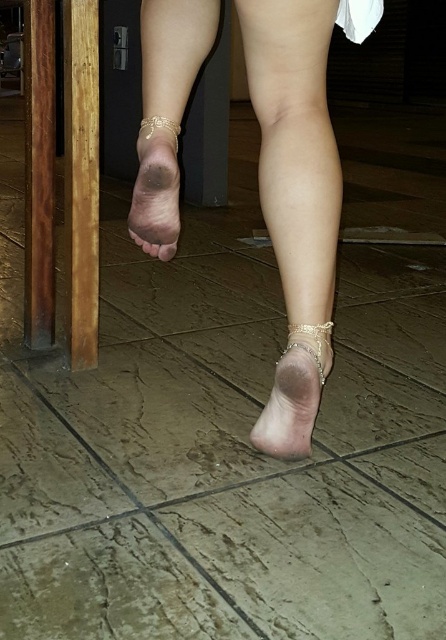
You are a stylist preparing to photograph a model wearing the gold metallic sandal at lower center and the dry skin at center. Based on the scene description, where should you position the sandal relative to the dry skin to match the image?

The gold metallic sandal at lower center should be positioned to the right of the dry skin at center to match the image.

You are a photographer adjusting your camera to capture the intricate details of the gold anklets on the person. You notice two points marked in the image. Which point, point (x=305, y=120) or point (x=330, y=353), is closer to your camera lens?

Point (x=305, y=120) is closer to the viewer than point (x=330, y=353), so it is closer to the camera lens.

You are a photographer standing in front of the smooth skin leg at center. You want to take a close up photo of the leg. The camera you are using has a minimum focusing distance of 30 inches. Can you take the photo without moving closer?

The smooth skin leg at center and viewer are 32.50 inches apart, so yes, you can take the photo without moving closer because the distance is within the camera minimum focusing distance of 30 inches.